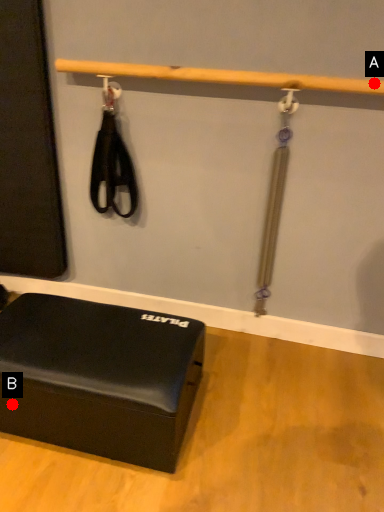
Question: Two points are circled on the image, labeled by A and B beside each circle. Which point is farther from the camera taking this photo?

Choices:
 (A) A is further
 (B) B is further

Answer: (A)